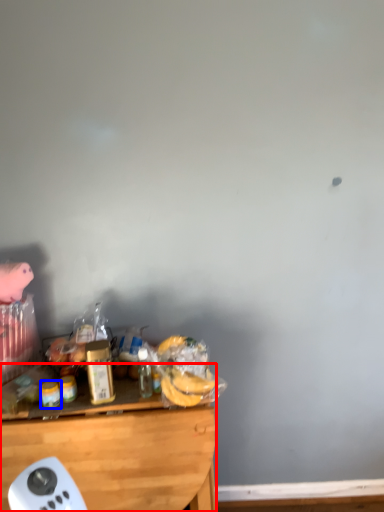
Question: Which object appears farthest to the camera in this image, desk (highlighted by a red box) or food (highlighted by a blue box)?

Choices:
 (A) desk
 (B) food

Answer: (B)